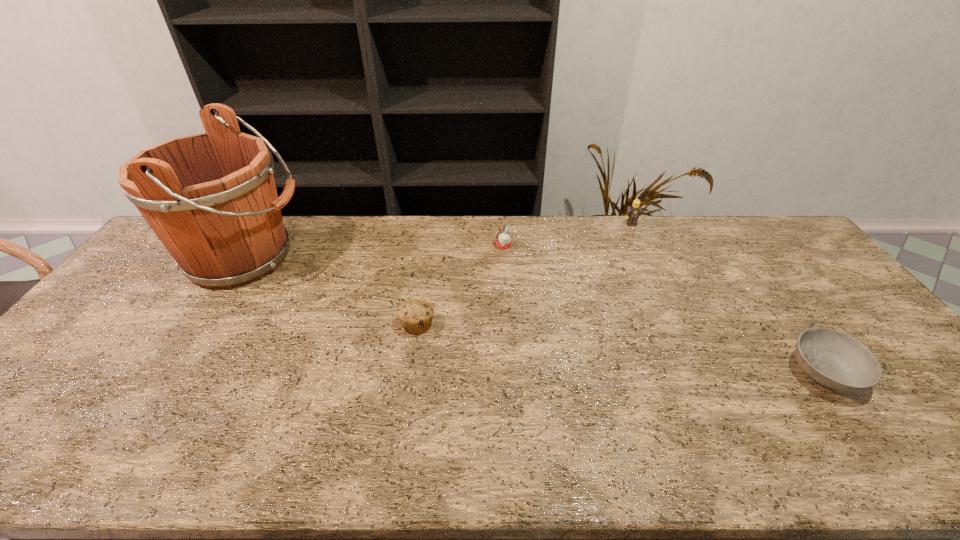
This screenshot has height=540, width=960. Find the location of `object present at the left edge`. object present at the left edge is located at coordinates (211, 198).

What are the coordinates of `object located at the right edge` in the screenshot? It's located at (833, 359).

At what (x,y) coordinates should I click in order to perform the action: click on object located in the far left corner section of the desktop. Please return your answer as a coordinate pair (x, y). The image size is (960, 540). Looking at the image, I should click on (211, 198).

The image size is (960, 540). In order to click on vacant region at the far edge of the desktop in this screenshot , I will do `click(648, 225)`.

Locate an element on the screen. The image size is (960, 540). free region at the near edge is located at coordinates (776, 448).

Locate an element on the screen. The width and height of the screenshot is (960, 540). vacant area at the left edge of the desktop is located at coordinates (102, 354).

Find the location of a particular element. This screenshot has height=540, width=960. free space at the far right corner of the desktop is located at coordinates (754, 217).

Where is `vacant point located between the second tallest object and the bowl`? This screenshot has height=540, width=960. vacant point located between the second tallest object and the bowl is located at coordinates (728, 299).

Locate an element on the screen. unoccupied area between the fourth object from right to left and the fourth shortest object is located at coordinates (524, 274).

Where is `unoccupied area between the second tallest object and the third object from left to right`? Image resolution: width=960 pixels, height=540 pixels. unoccupied area between the second tallest object and the third object from left to right is located at coordinates (567, 235).